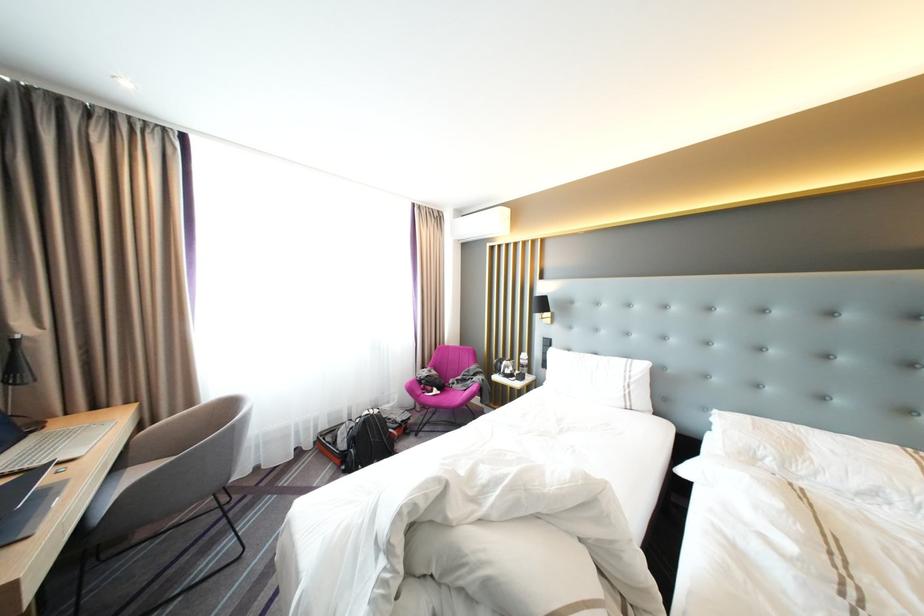
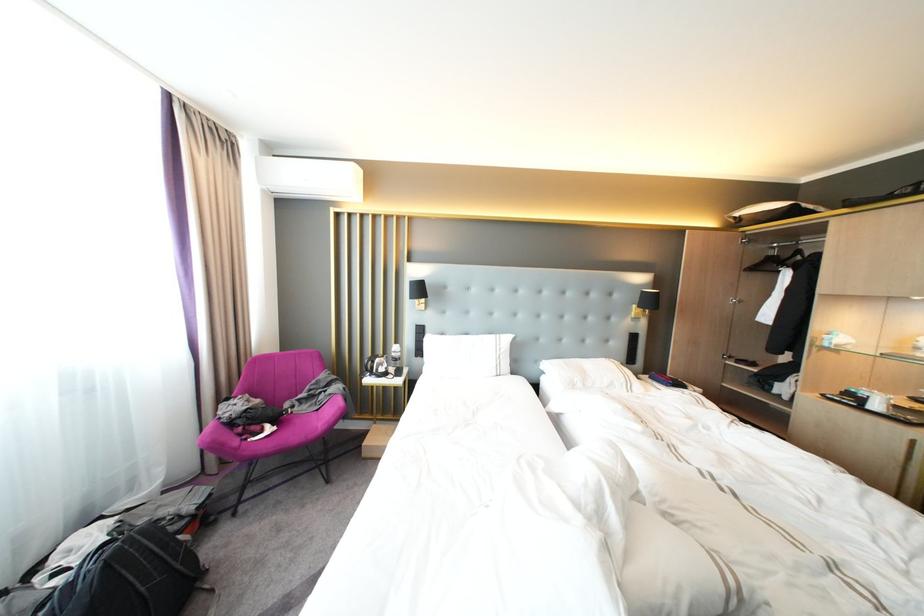
In the second image, find the point that corresponds to (x=513, y=363) in the first image.

(384, 363)